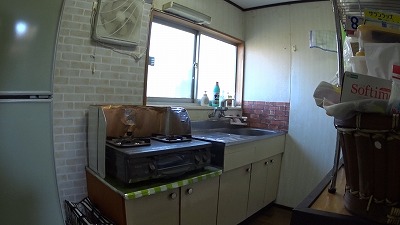
Locate an element on the screen. white fan on wall is located at coordinates (117, 21).